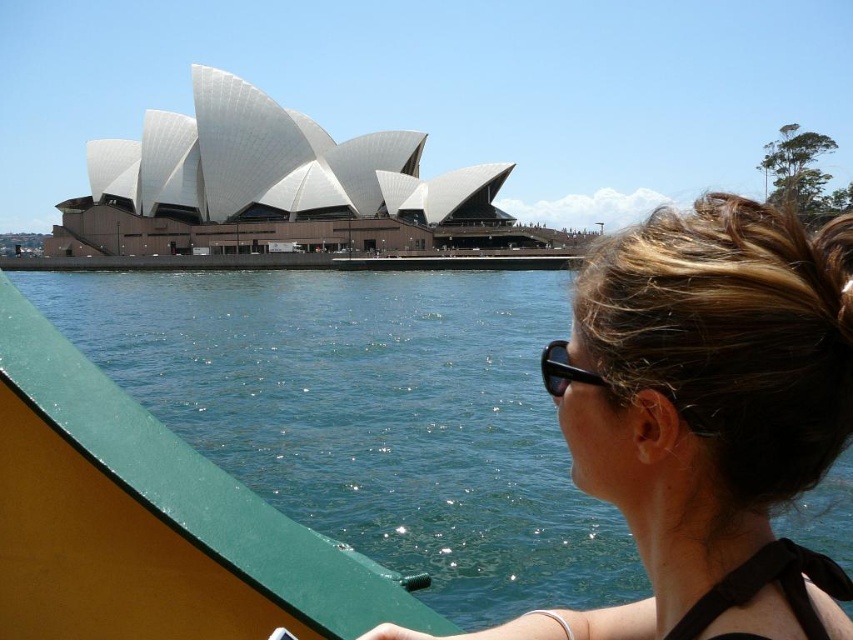
You are on a boat near Sydney Opera House and want to protect your eyes from the sun. You have two options in the upper right corner of your view. Which one should you choose between the black plastic goggles at upper right and the black plastic sunglasses at upper right?

The black plastic goggles at upper right is taller than the black plastic sunglasses at upper right, so it would provide better protection from sunlight as it covers more of the eyes and surrounding area.

You are on a boat near Sydney Opera House and want to know the position of the blonde hair bun at center relative to the black plastic goggles at upper right. Which object is positioned to the right?

The blonde hair bun at center is positioned to the right of the black plastic goggles at upper right.